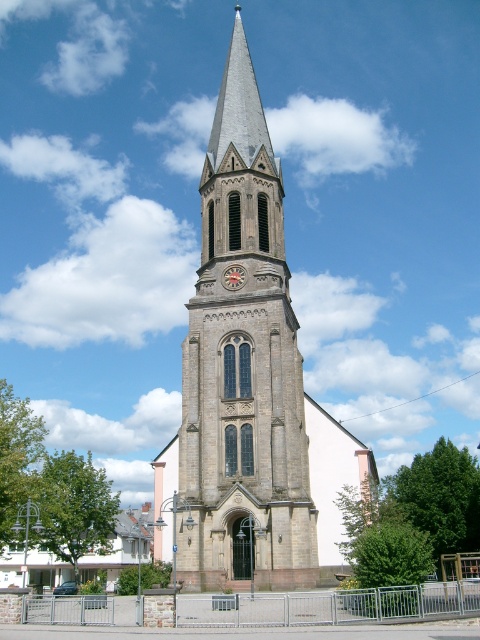
Which of these two, brown stone clock tower at center or red painted wooden clock at center, stands taller?

With more height is brown stone clock tower at center.

Who is shorter, brown stone clock tower at center or red painted wooden clock at center?

Standing shorter between the two is red painted wooden clock at center.

Which is behind, point (264, 332) or point (224, 284)?

Point (224, 284)

You are a GUI agent. You are given a task and a screenshot of the screen. Output one action in this format:
    pyautogui.click(x=<x>, y=<y>)
    Task: Click on the brown stone clock tower at center
    This screenshot has width=480, height=640.
    Given the screenshot: What is the action you would take?
    pyautogui.click(x=242, y=365)